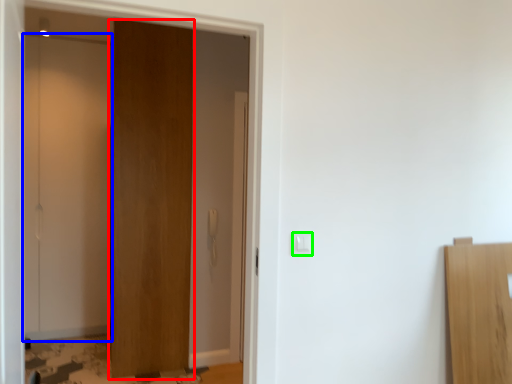
Question: Which is nearer to the door (highlighted by a red box)? door (highlighted by a blue box) or light switch (highlighted by a green box).

Choices:
 (A) door
 (B) light switch

Answer: (A)